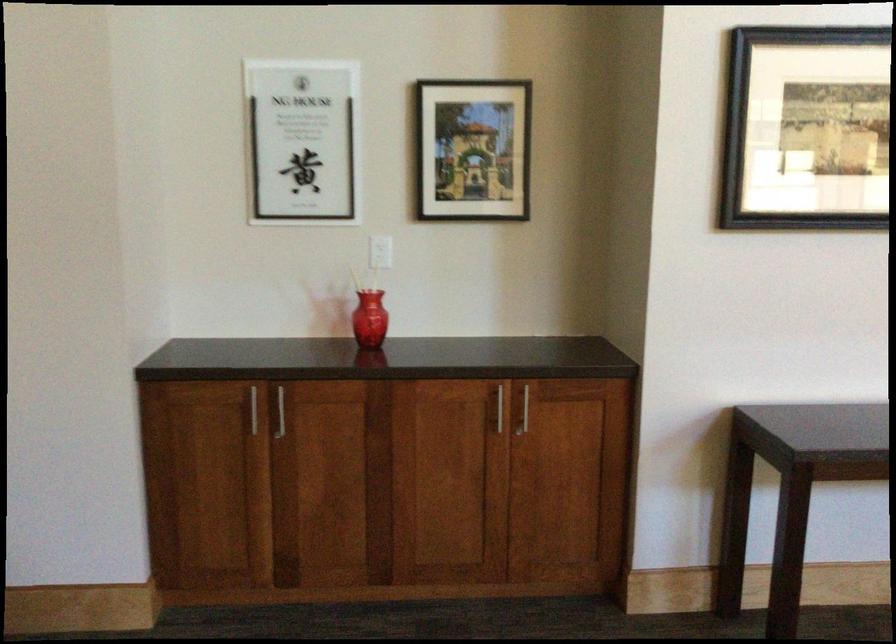
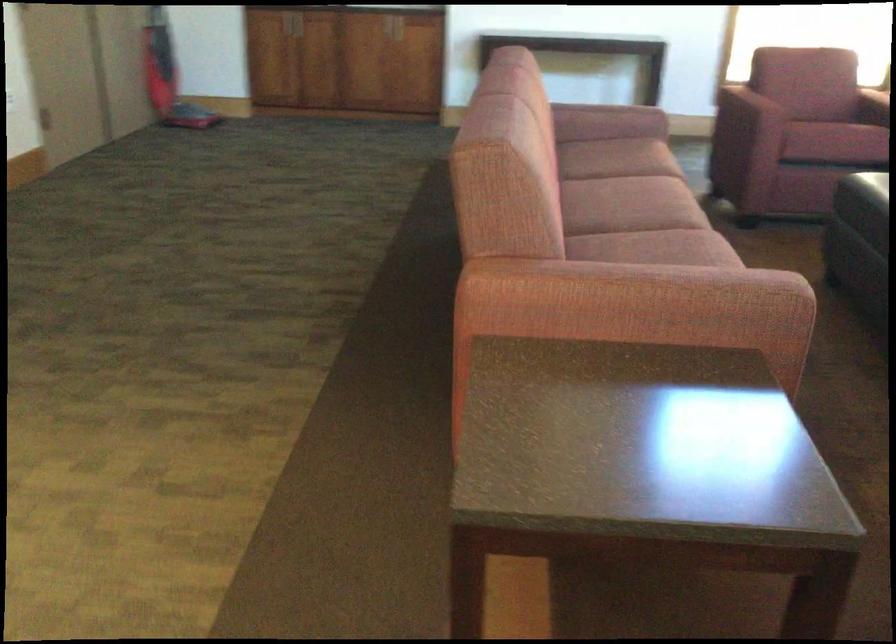
What movement of the cameraman would produce the second image?

The cameraman walked toward right, backward.